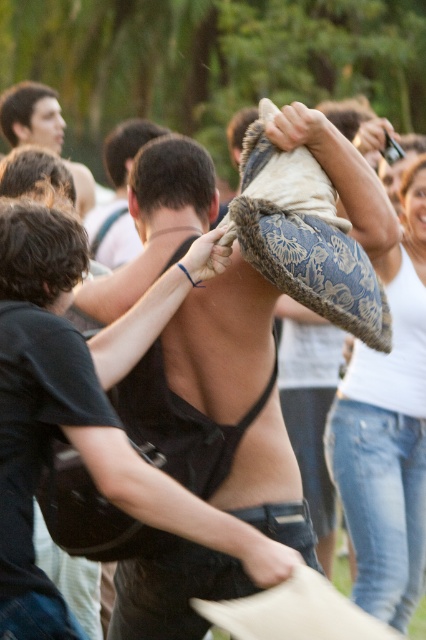
Question: Is black fabric bra at center thinner than blue patterned pillow at upper right?

Choices:
 (A) no
 (B) yes

Answer: (A)

Question: Which object appears farthest from the camera in this image?

Choices:
 (A) dark brown hair at upper left
 (B) black fabric bra at center

Answer: (A)

Question: Which point appears farthest from the camera in this image?

Choices:
 (A) (29, 376)
 (B) (342, 499)
 (C) (131, 241)

Answer: (C)

Question: In this image, where is blue patterned pillow at upper right located relative to shiny black tank top at center?

Choices:
 (A) above
 (B) below

Answer: (B)

Question: Is black fabric bra at center wider than dark brown hair at upper left?

Choices:
 (A) yes
 (B) no

Answer: (A)

Question: Based on their relative distances, which object is farther from the black fabric bra at center?

Choices:
 (A) shiny black tank top at center
 (B) dark brown hair at upper left
 (C) blue patterned pillow at upper right

Answer: (B)